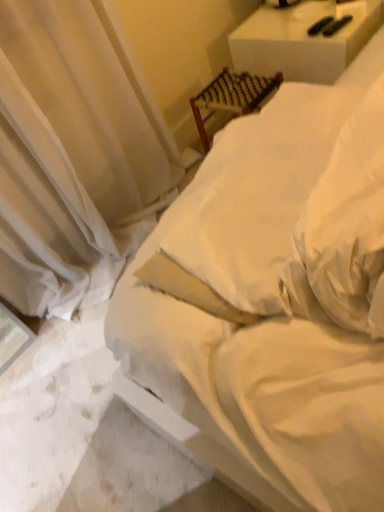
Question: Can white sheer curtain at upper left be found inside white woven chair at upper right, the first furniture when ordered from right to left?

Choices:
 (A) no
 (B) yes

Answer: (A)

Question: Considering the relative positions of white woven chair at upper right, the first furniture when ordered from right to left, and white sheer curtain at upper left in the image provided, is white woven chair at upper right, the first furniture when ordered from right to left, behind white sheer curtain at upper left?

Choices:
 (A) no
 (B) yes

Answer: (B)

Question: Can you confirm if white woven chair at upper right, the first furniture when ordered from right to left, is wider than white sheer curtain at upper left?

Choices:
 (A) no
 (B) yes

Answer: (B)

Question: Can you confirm if white woven chair at upper right, the 2th furniture from the left, is bigger than white sheer curtain at upper left?

Choices:
 (A) no
 (B) yes

Answer: (A)

Question: Is white woven chair at upper right, the 2th furniture from the left, smaller than white sheer curtain at upper left?

Choices:
 (A) yes
 (B) no

Answer: (A)

Question: Would you say woven wood chair at upper center, marked as the second furniture in a right-to-left arrangement, is inside or outside white sheer curtain at upper left?

Choices:
 (A) outside
 (B) inside

Answer: (A)

Question: From a real-world perspective, is woven wood chair at upper center, marked as the second furniture in a right-to-left arrangement, physically located above or below white sheer curtain at upper left?

Choices:
 (A) below
 (B) above

Answer: (A)

Question: Is woven wood chair at upper center, which ranks as the first furniture in left-to-right order, in front of or behind white sheer curtain at upper left in the image?

Choices:
 (A) front
 (B) behind

Answer: (B)

Question: Considering the positions of point (256, 101) and point (140, 194), is point (256, 101) closer or farther from the camera than point (140, 194)?

Choices:
 (A) farther
 (B) closer

Answer: (B)

Question: Is white soft bed at center in front of or behind white sheer curtain at upper left in the image?

Choices:
 (A) behind
 (B) front

Answer: (B)

Question: In terms of size, does white soft bed at center appear bigger or smaller than white sheer curtain at upper left?

Choices:
 (A) big
 (B) small

Answer: (A)

Question: Is point (334, 489) closer or farther from the camera than point (79, 197)?

Choices:
 (A) closer
 (B) farther

Answer: (A)

Question: Would you say white soft bed at center is to the left or to the right of white sheer curtain at upper left in the picture?

Choices:
 (A) right
 (B) left

Answer: (A)

Question: Looking at their shapes, would you say white sheer curtain at upper left is wider or thinner than woven wood chair at upper center, which ranks as the first furniture in left-to-right order?

Choices:
 (A) thin
 (B) wide

Answer: (B)

Question: From the image's perspective, is white sheer curtain at upper left positioned above or below woven wood chair at upper center, which ranks as the first furniture in left-to-right order?

Choices:
 (A) above
 (B) below

Answer: (B)